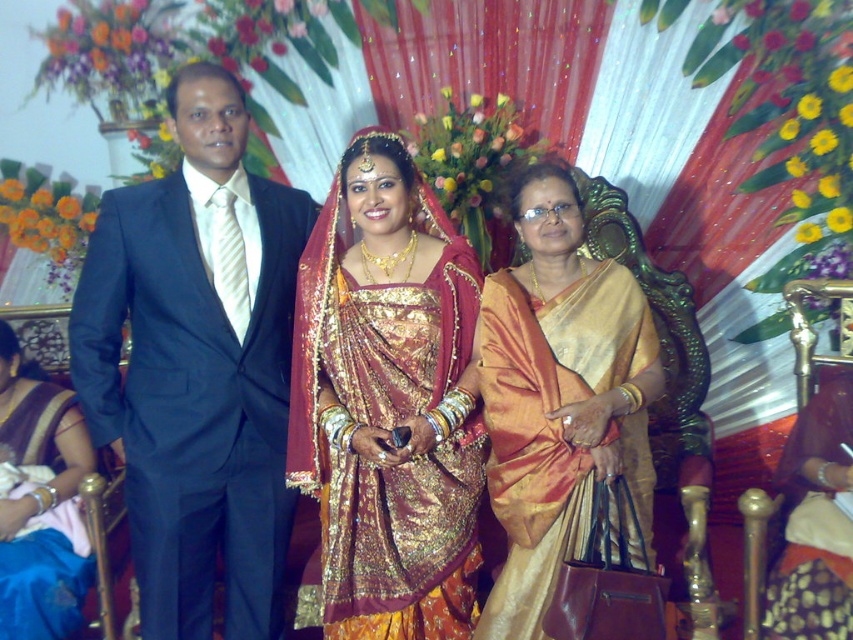
Question: Which of the following is the farthest from the observer?

Choices:
 (A) (602, 336)
 (B) (239, 106)
 (C) (479, 282)
 (D) (45, 621)

Answer: (C)

Question: Which point appears closest to the camera in this image?

Choices:
 (A) (543, 552)
 (B) (193, 492)
 (C) (3, 342)

Answer: (A)

Question: Is silky gold sari at center further to camera compared to silky blue saree at lower left?

Choices:
 (A) yes
 (B) no

Answer: (B)

Question: Is the position of matte black suit at left less distant than that of silky blue saree at lower left?

Choices:
 (A) yes
 (B) no

Answer: (B)

Question: Can you confirm if shiny black suit at left is bigger than silky gold sari at center?

Choices:
 (A) no
 (B) yes

Answer: (B)

Question: Which point is farther to the camera?

Choices:
 (A) (283, 465)
 (B) (80, 604)

Answer: (B)